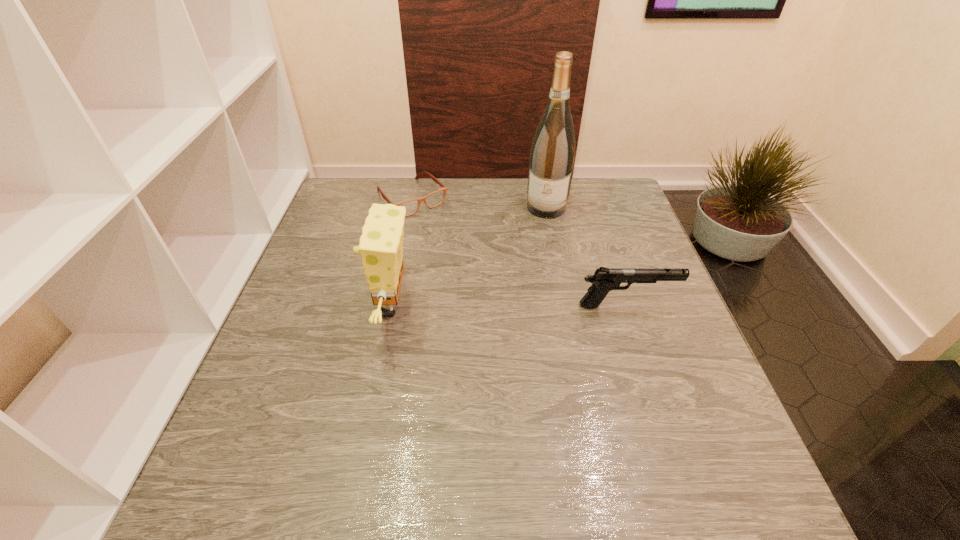
Find the location of `vacant space that's between the second shortest object and the shortest object`. vacant space that's between the second shortest object and the shortest object is located at coordinates (519, 252).

Find the location of `free space between the tallest object and the third tallest object`. free space between the tallest object and the third tallest object is located at coordinates (587, 256).

This screenshot has height=540, width=960. I want to click on unoccupied area between the sponge and the wine bottle, so click(468, 256).

You are a GUI agent. You are given a task and a screenshot of the screen. Output one action in this format:
    pyautogui.click(x=<x>, y=<y>)
    Task: Click on the free space that is in between the third tallest object and the spectacles
    This screenshot has height=540, width=960.
    Given the screenshot: What is the action you would take?
    pyautogui.click(x=519, y=252)

Find the location of a particular element. vacant point located between the wine bottle and the second tallest object is located at coordinates (468, 256).

The height and width of the screenshot is (540, 960). Identify the location of object that stands as the third closest to the wine bottle. (381, 242).

Where is `the third closest object relative to the tallest object`? the third closest object relative to the tallest object is located at coordinates (381, 242).

I want to click on free space that satisfies the following two spatial constraints: 1. on the front side of the spectacles; 2. at the aiming end of the gun, so click(x=390, y=306).

Where is `free location that satisfies the following two spatial constraints: 1. on the front side of the shortest object; 2. on the left side of the tallest object`? The image size is (960, 540). free location that satisfies the following two spatial constraints: 1. on the front side of the shortest object; 2. on the left side of the tallest object is located at coordinates (410, 207).

You are a GUI agent. You are given a task and a screenshot of the screen. Output one action in this format:
    pyautogui.click(x=<x>, y=<y>)
    Task: Click on the vacant space that satisfies the following two spatial constraints: 1. on the front side of the tallest object; 2. at the aiming end of the second shortest object
    
    Given the screenshot: What is the action you would take?
    pyautogui.click(x=565, y=306)